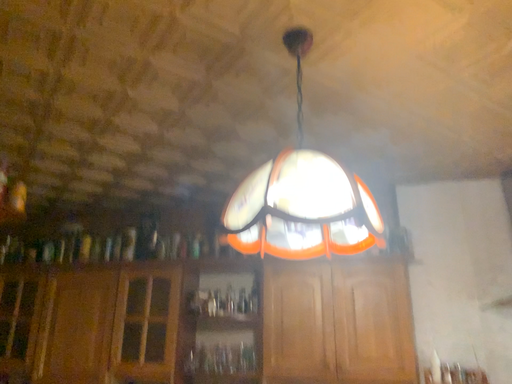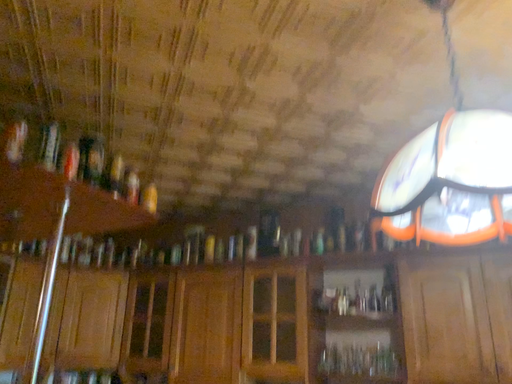
Question: How did the camera likely rotate when shooting the video?

Choices:
 (A) rotated right
 (B) rotated left

Answer: (B)